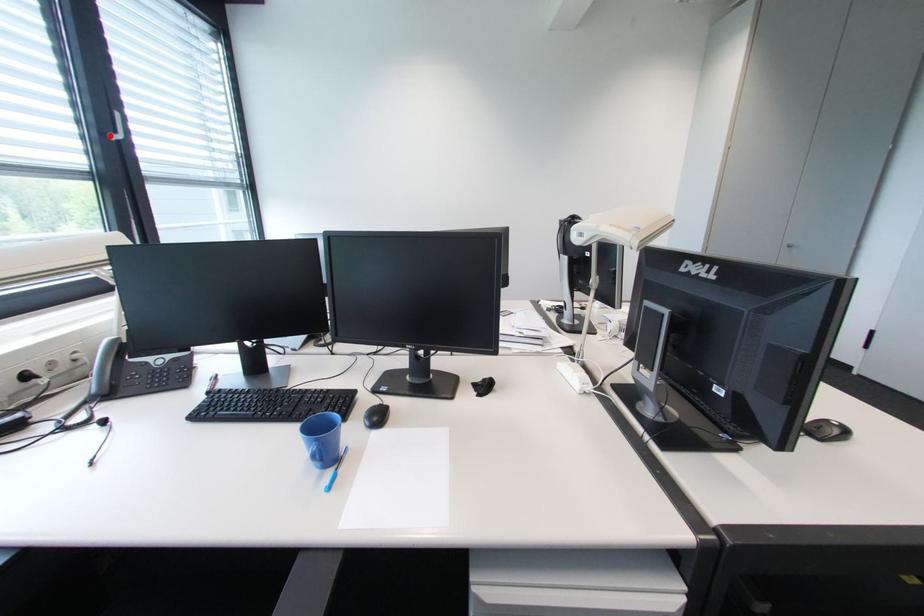
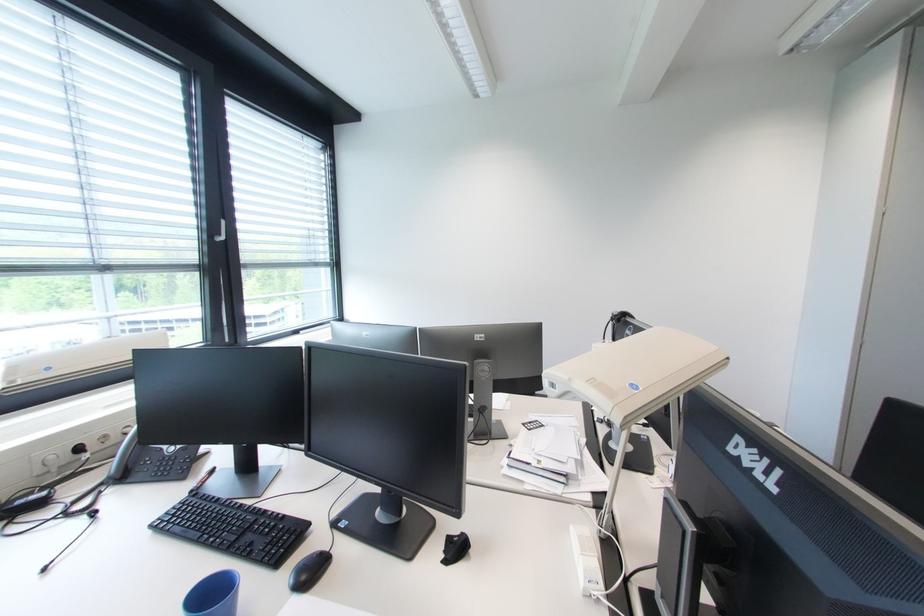
Question: I am providing you with two images of the same scene from different viewpoints. In image1, a red point is highlighted. Considering the same 3D point in image2, which of the following is correct?

Choices:
 (A) It is closer
 (B) It is farther

Answer: (A)